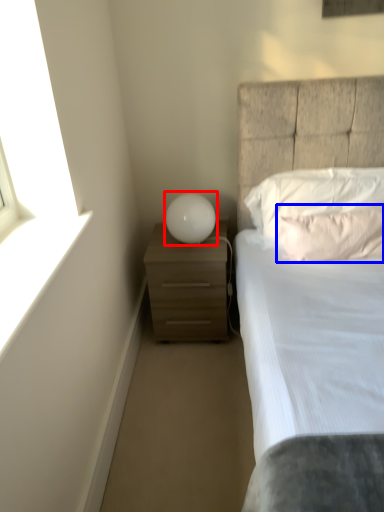
Question: Which object appears closest to the camera in this image, table lamp (highlighted by a red box) or pillow (highlighted by a blue box)?

Choices:
 (A) table lamp
 (B) pillow

Answer: (B)